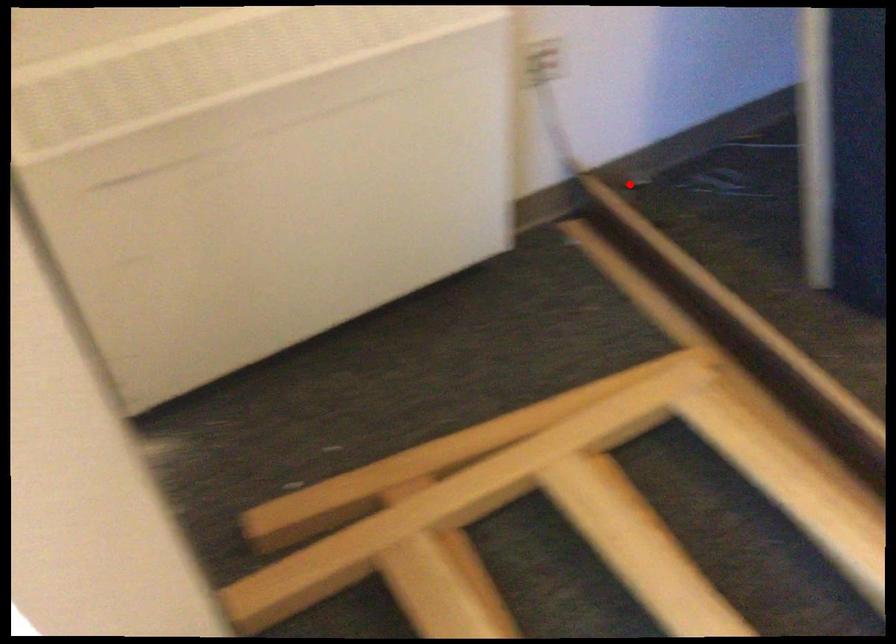
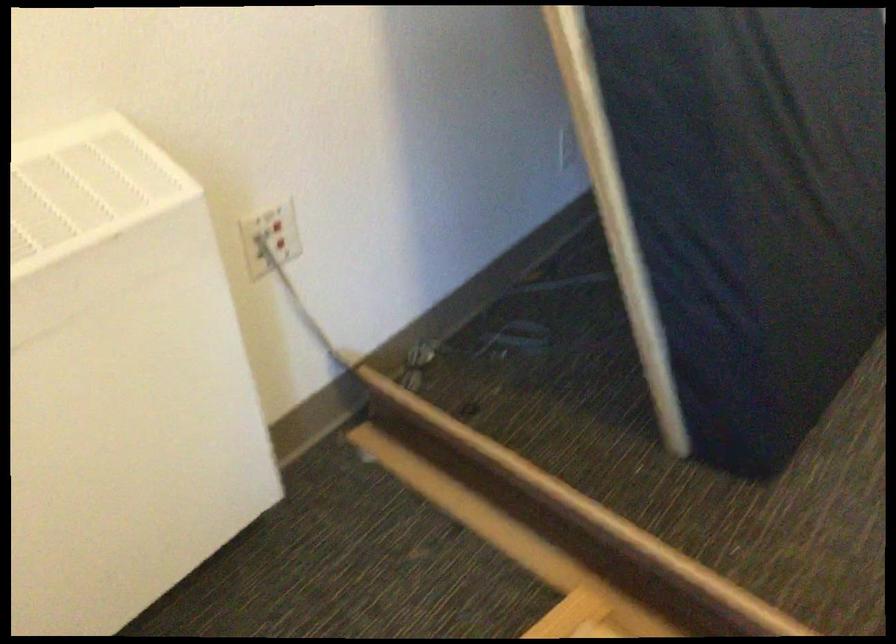
Find the pixel in the second image that matches the highlighted location in the first image.

(418, 363)